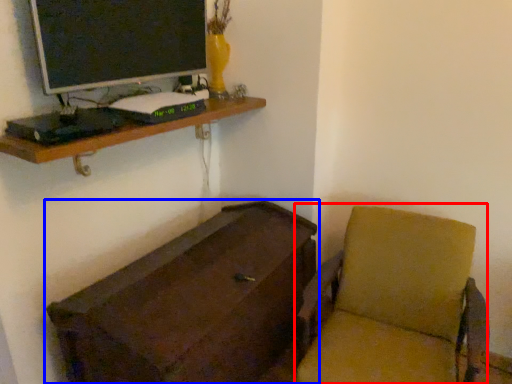
Question: Which point is closer to the camera, swivel chair (highlighted by a red box) or furniture (highlighted by a blue box)?

Choices:
 (A) swivel chair
 (B) furniture

Answer: (A)